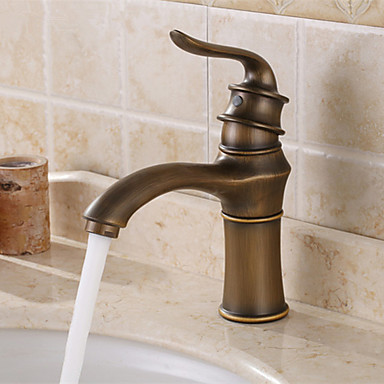
Where is `white square tiles`? This screenshot has height=384, width=384. white square tiles is located at coordinates (21, 37), (94, 58), (164, 73), (270, 46), (351, 79), (13, 122), (97, 147), (177, 142), (290, 158), (353, 195).